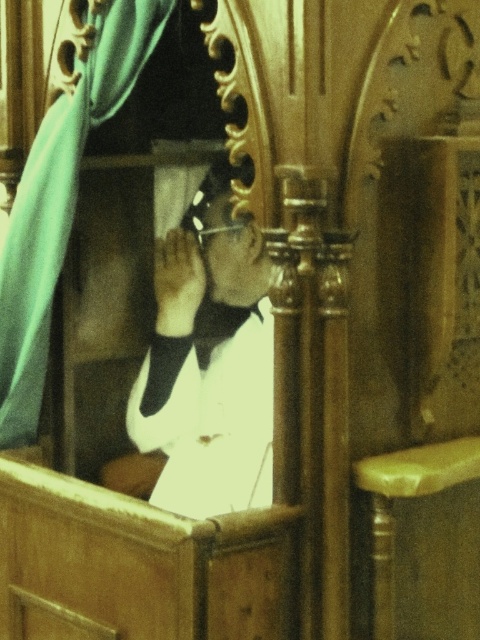
Measure the distance between teal fabric curtain at left and camera.

teal fabric curtain at left and camera are 5.34 feet apart.

Is teal fabric curtain at left to the right of light brown wooden stool at lower right from the viewer's perspective?

In fact, teal fabric curtain at left is to the left of light brown wooden stool at lower right.

Find the location of a particular element. teal fabric curtain at left is located at coordinates (60, 204).

Where is `teal fabric curtain at left`? teal fabric curtain at left is located at coordinates (60, 204).

Between white glossy shirt at center and teal fabric curtain at left, which one has more height?

teal fabric curtain at left is taller.

How far apart are white glossy shirt at center and teal fabric curtain at left?

12.18 inches

Where is `white glossy shirt at center`? This screenshot has width=480, height=640. white glossy shirt at center is located at coordinates (208, 364).

I want to click on white glossy shirt at center, so click(x=208, y=364).

Which is more to the right, white glossy shirt at center or light brown wooden stool at lower right?

Positioned to the right is light brown wooden stool at lower right.

Can you confirm if white glossy shirt at center is smaller than light brown wooden stool at lower right?

No.

Which is behind, point (207, 442) or point (385, 548)?

Point (207, 442)

Locate an element on the screen. white glossy shirt at center is located at coordinates (208, 364).